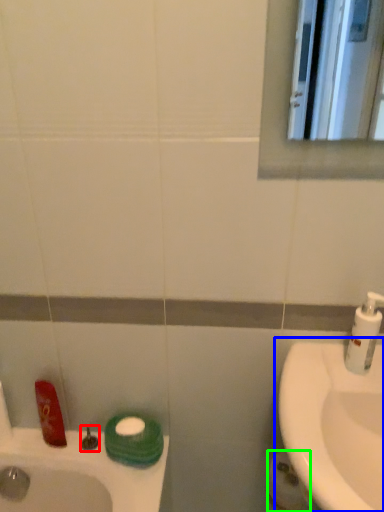
Question: Estimate the real-world distances between objects in this image. Which object is farther from plumbing fixture (highlighted by a red box), sink (highlighted by a blue box) or toilet paper (highlighted by a green box)?

Choices:
 (A) sink
 (B) toilet paper

Answer: (A)